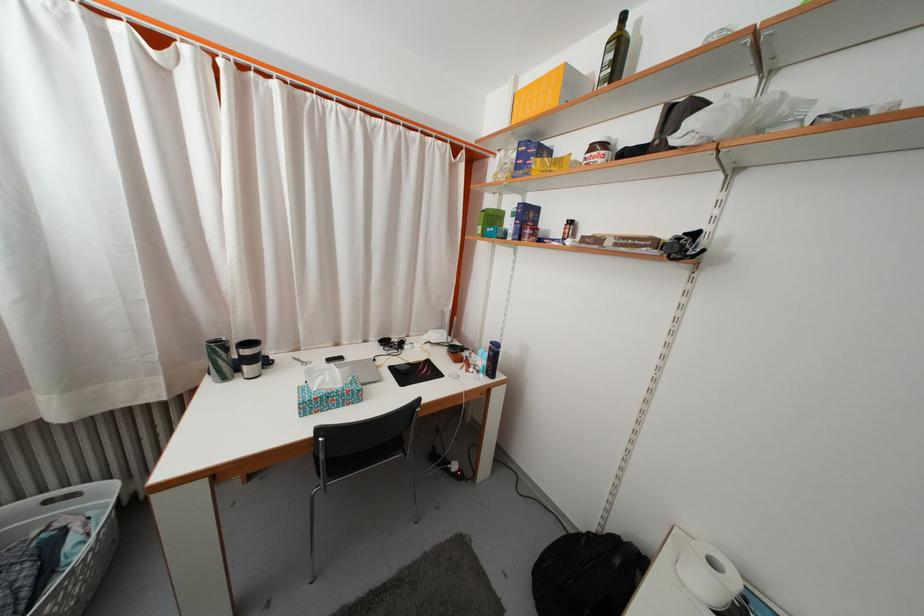
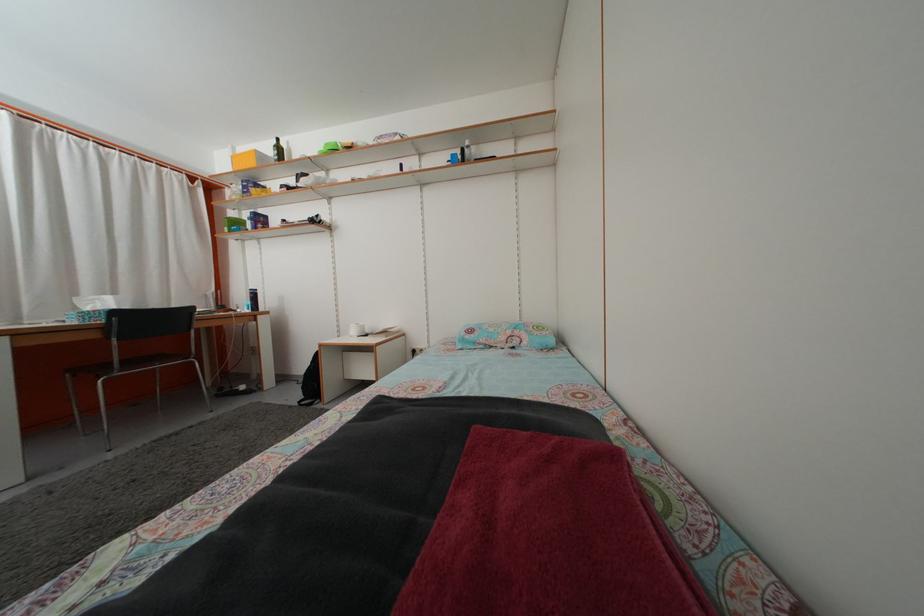
Locate, in the second image, the point that corresponds to point 619,34 in the first image.

(281, 148)